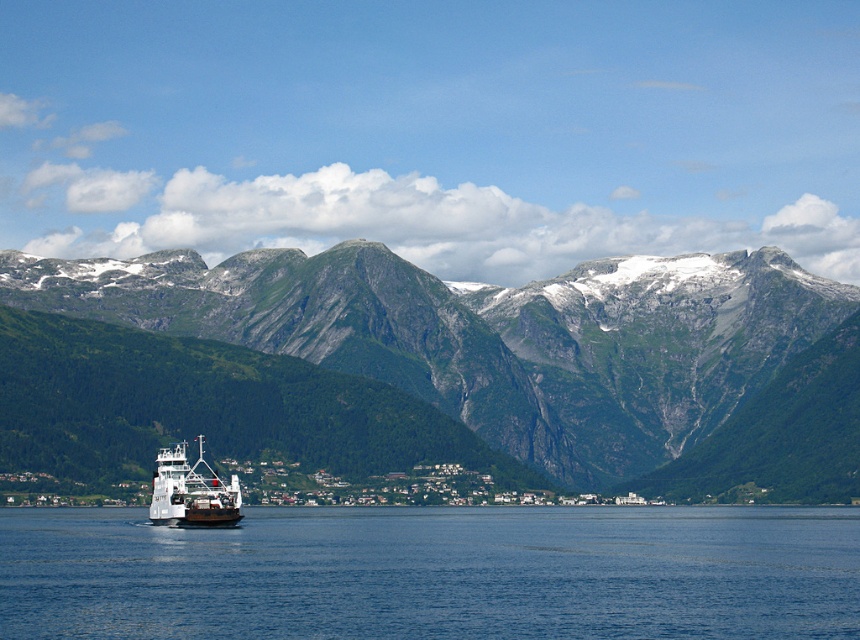
Is blue water at center above white matte ferry at lower left?

No, blue water at center is not above white matte ferry at lower left.

Between blue water at center and white matte ferry at lower left, which one has less height?

Standing shorter between the two is white matte ferry at lower left.

Is point (742, 534) less distant than point (212, 500)?

No, it is behind (212, 500).

In order to click on blue water at center in this screenshot , I will do `click(434, 572)`.

At what (x,y) coordinates should I click in order to perform the action: click on green rocky mountains at upper center. Please return your answer as a coordinate pair (x, y). Looking at the image, I should click on (432, 131).

Is green rocky mountains at upper center shorter than white matte ferry at lower left?

In fact, green rocky mountains at upper center may be taller than white matte ferry at lower left.

The height and width of the screenshot is (640, 860). Find the location of `green rocky mountains at upper center`. green rocky mountains at upper center is located at coordinates click(432, 131).

Identify the location of green rocky mountains at upper center. (432, 131).

Is green rocky mountains at upper center above blue water at center?

Correct, green rocky mountains at upper center is located above blue water at center.

Between point (447, 104) and point (557, 548), which one is positioned behind?

The point (447, 104) is more distant.

I want to click on green rocky mountains at upper center, so click(432, 131).